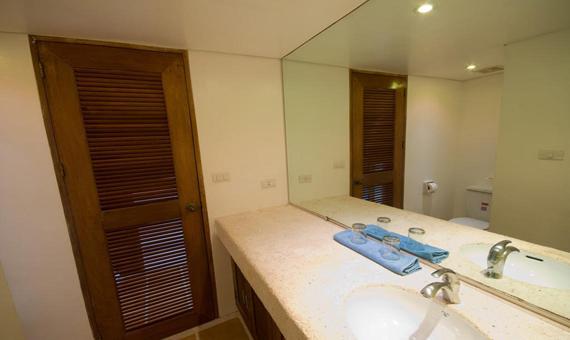
Where can what people would use to turn water on and off be observed in this image? Your answer should be formatted as a list of tuples, i.e. [(x1, y1), (x2, y2), ...], where each tuple contains the x and y coordinates of a point satisfying the conditions above.

[(445, 270)]